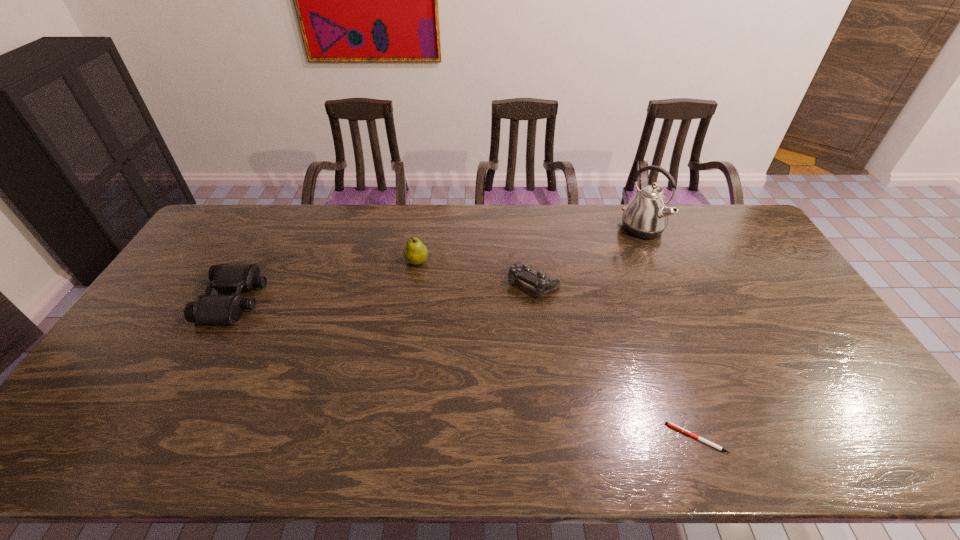
In order to click on free spot located 0.360m on the front of the pear in this screenshot , I will do `click(402, 360)`.

The width and height of the screenshot is (960, 540). Find the location of `vacant space located 0.320m through the eyepieces of the leftmost object`. vacant space located 0.320m through the eyepieces of the leftmost object is located at coordinates (367, 300).

What are the coordinates of `free space located 0.160m on the back of the second shortest object` in the screenshot? It's located at (528, 237).

Find the location of a particular element. The image size is (960, 540). free region located on the clicker of the shortest object is located at coordinates (644, 438).

Locate an element on the screen. free space located on the clicker of the shortest object is located at coordinates (606, 438).

In order to click on vacant space situated on the clicker of the shortest object in this screenshot , I will do `click(516, 438)`.

You are a GUI agent. You are given a task and a screenshot of the screen. Output one action in this format:
    pyautogui.click(x=<x>, y=<y>)
    Task: Click on the object at the far edge
    
    Given the screenshot: What is the action you would take?
    pyautogui.click(x=646, y=216)

Image resolution: width=960 pixels, height=540 pixels. I want to click on object located in the near edge section of the desktop, so click(670, 424).

Find the location of `object present at the left edge`. object present at the left edge is located at coordinates pyautogui.click(x=206, y=309).

This screenshot has width=960, height=540. In order to click on free point at the far edge in this screenshot , I will do `click(532, 205)`.